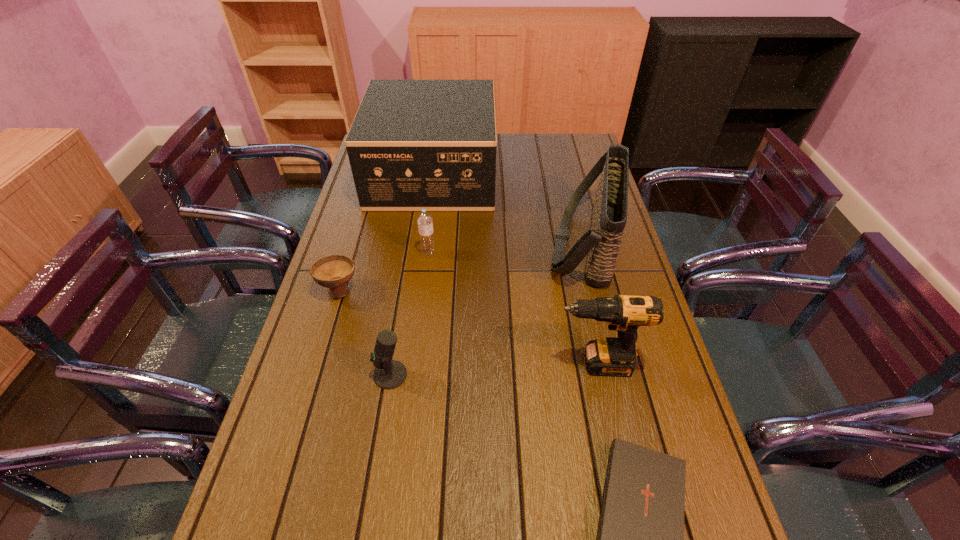
Image resolution: width=960 pixels, height=540 pixels. Find the location of `box`. box is located at coordinates (414, 144).

This screenshot has width=960, height=540. I want to click on handbag, so click(x=601, y=243).

At what (x,y) coordinates should I click in order to perform the action: click on drill. Please return your answer as a coordinate pair (x, y). Looking at the image, I should click on (612, 356).

Image resolution: width=960 pixels, height=540 pixels. I want to click on water bottle, so click(425, 221).

Locate an element on the screen. The width and height of the screenshot is (960, 540). microphone is located at coordinates (389, 374).

This screenshot has height=540, width=960. I want to click on the sixth tallest object, so click(334, 271).

Identify the location of vacant space located on the front-facing side of the box. The width and height of the screenshot is (960, 540). (540, 174).

Locate an element on the screen. This screenshot has width=960, height=540. vacant area located 0.060m on the back of the handbag is located at coordinates (573, 193).

The height and width of the screenshot is (540, 960). I want to click on vacant space situated 0.250m at the tip of the drill, so click(x=453, y=364).

The height and width of the screenshot is (540, 960). Find the location of `vacant space located 0.070m at the tip of the drill`. vacant space located 0.070m at the tip of the drill is located at coordinates (525, 364).